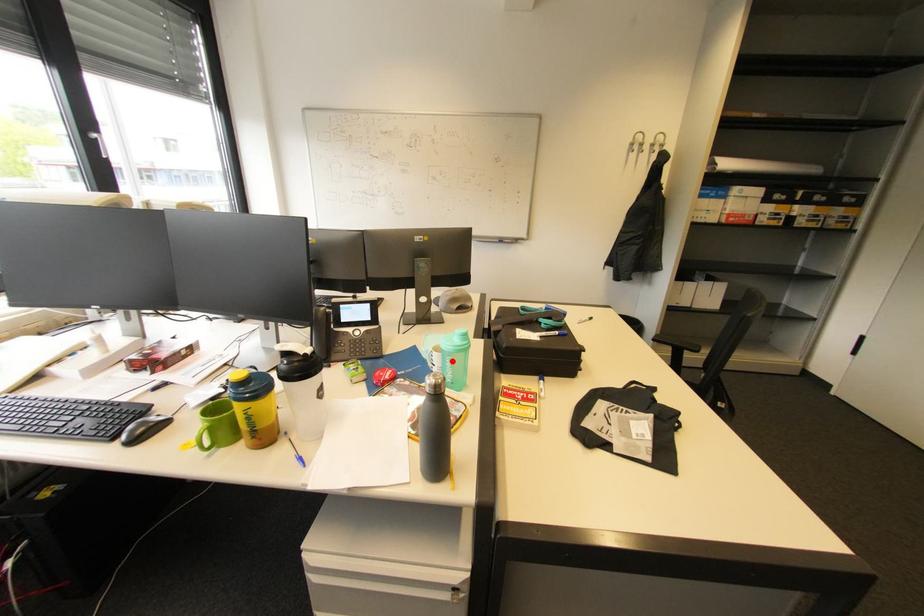
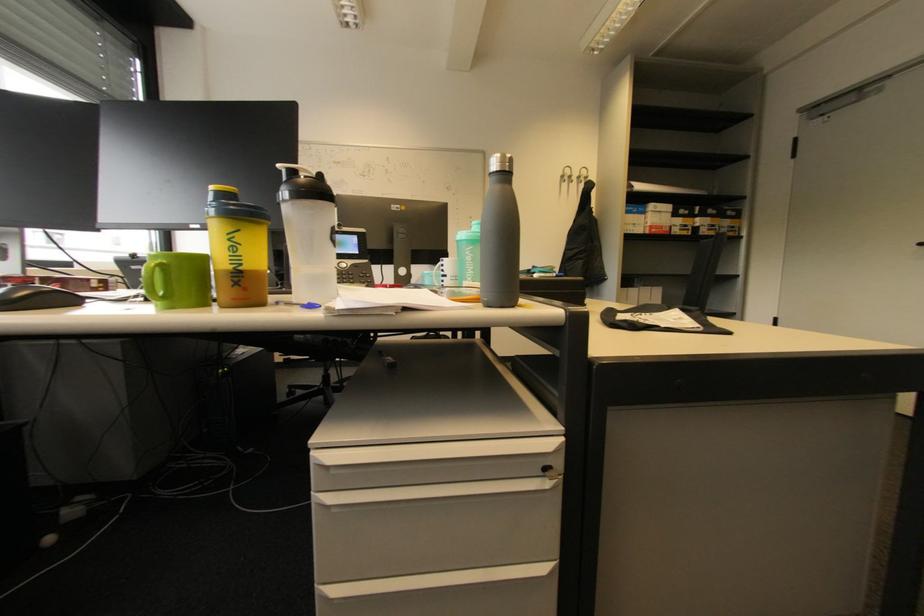
Locate, in the second image, the point that corresponds to the highlighted location in the first image.

(472, 254)